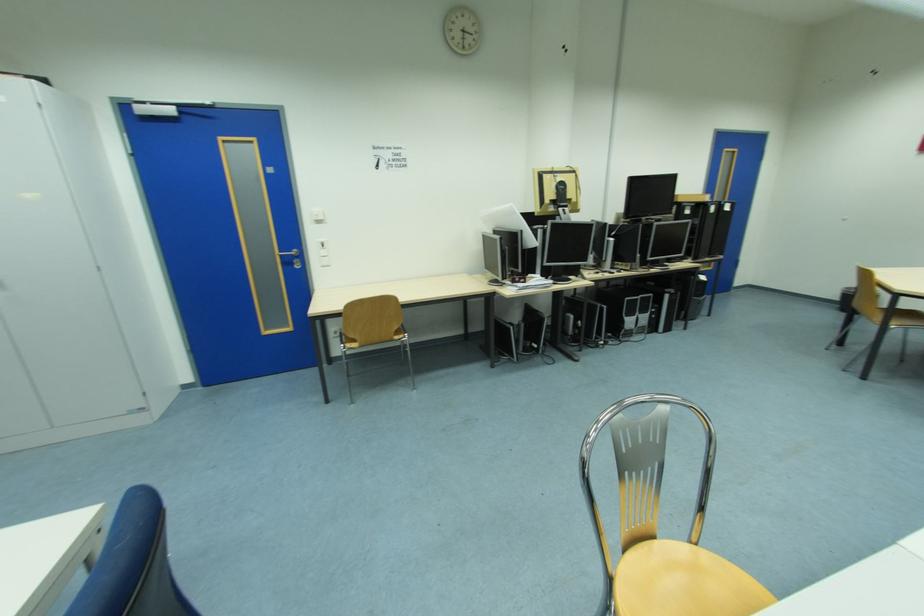
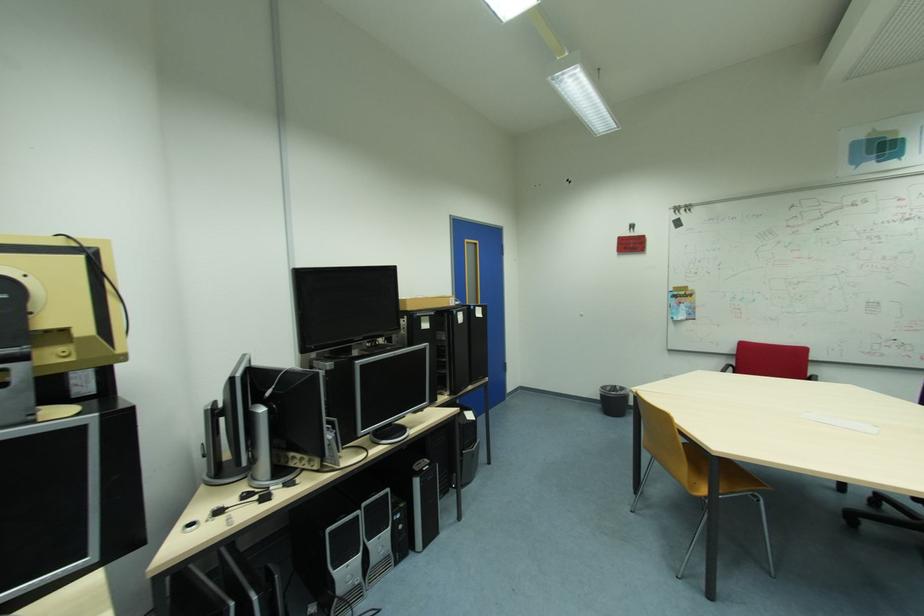
The point at (695, 213) is marked in the first image. Where is the corresponding point in the second image?

(432, 326)